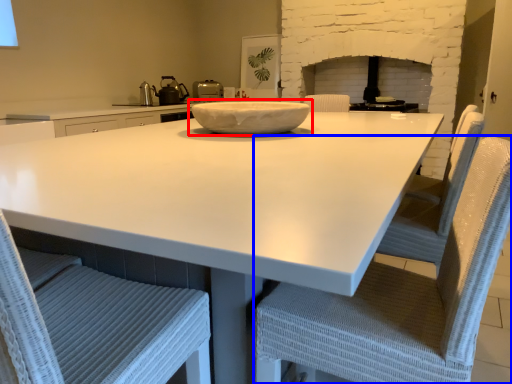
Question: Which of the following is the farthest to the observer, bowl (highlighted by a red box) or chair (highlighted by a blue box)?

Choices:
 (A) bowl
 (B) chair

Answer: (A)